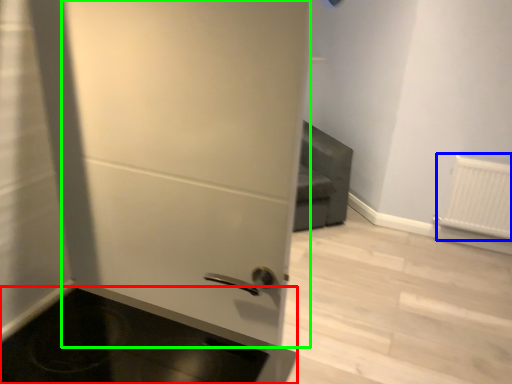
Question: Which object is positioned closest to appliance (highlighted by a red box)? Select from radiator (highlighted by a blue box) and door (highlighted by a green box).

Choices:
 (A) radiator
 (B) door

Answer: (B)